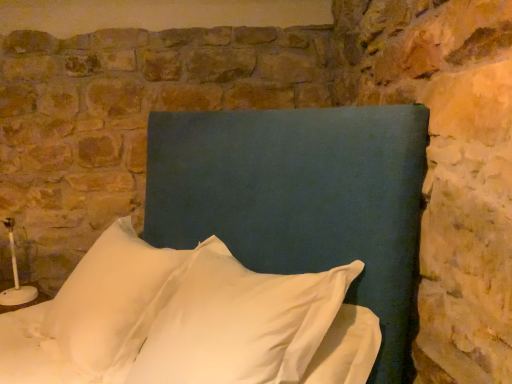
Question: In terms of width, does matte blue headboard at center look wider or thinner when compared to white fabric pillow at center, which is the first pillow in right-to-left order?

Choices:
 (A) thin
 (B) wide

Answer: (B)

Question: From the image's perspective, relative to white fabric pillow at center, which is the first pillow in right-to-left order, is matte blue headboard at center above or below?

Choices:
 (A) above
 (B) below

Answer: (A)

Question: Based on their relative distances, which object is nearer to the white soft pillow at center, positioned as the 2th pillow in right-to-left order?

Choices:
 (A) white fabric pillow at center, which is the first pillow in right-to-left order
 (B) matte blue headboard at center

Answer: (A)

Question: Based on their relative distances, which object is nearer to the matte blue headboard at center?

Choices:
 (A) white soft pillow at center, acting as the 1th pillow starting from the left
 (B) white fabric pillow at center, the second pillow in the left-to-right sequence

Answer: (B)